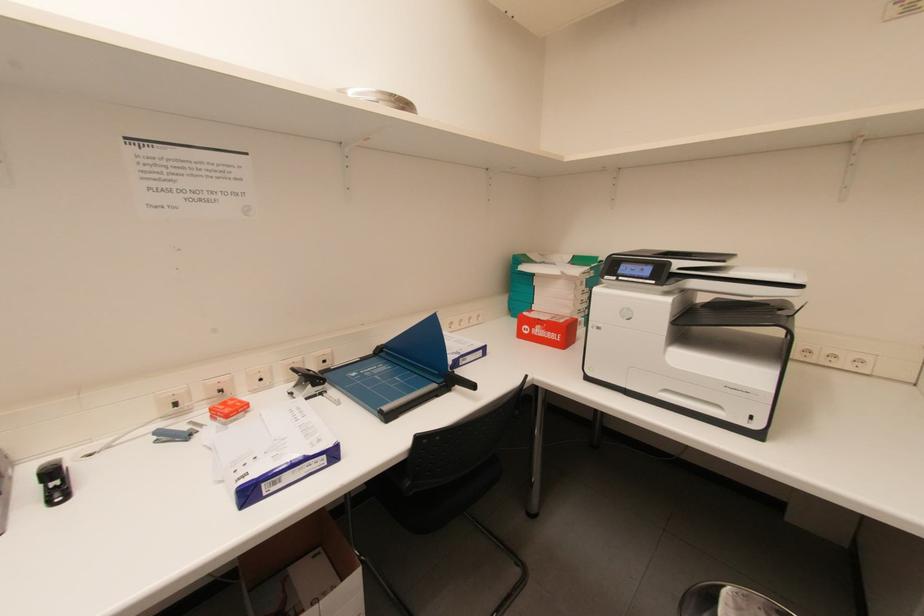
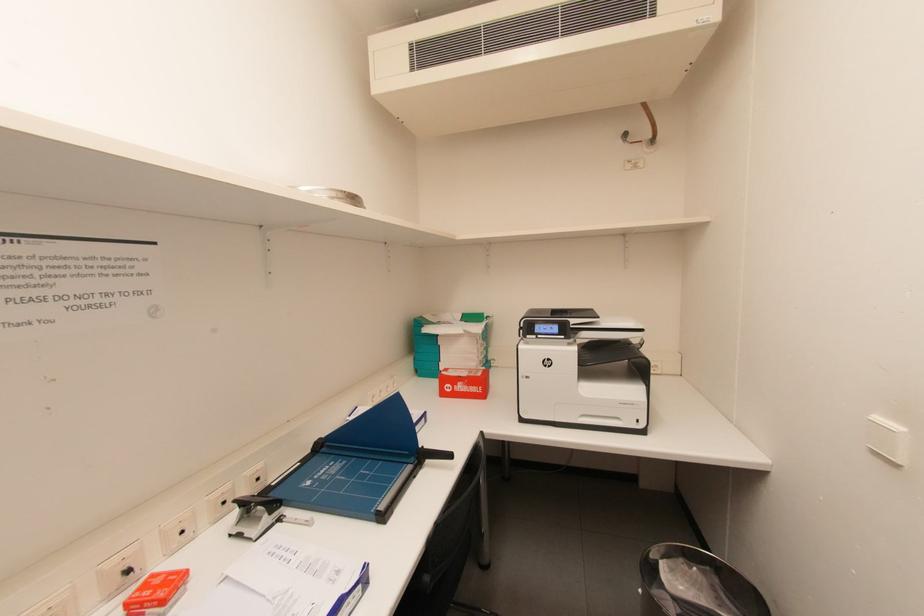
Question: How did the camera likely rotate?

Choices:
 (A) Left
 (B) Right
 (C) Up
 (D) Down

Answer: (B)